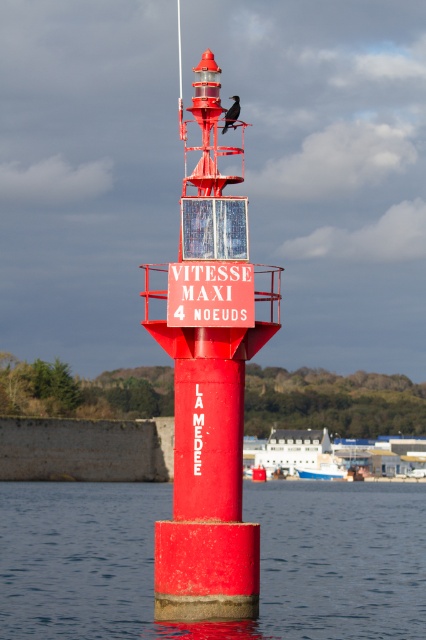
Question: Can you confirm if smooth concrete water at center is bigger than matte red buoy at center?

Choices:
 (A) no
 (B) yes

Answer: (B)

Question: Which point is farther to the camera?

Choices:
 (A) (x=112, y=612)
 (B) (x=256, y=540)

Answer: (A)

Question: From the image, what is the correct spatial relationship of smooth concrete water at center in relation to matte red buoy at center?

Choices:
 (A) left
 (B) right

Answer: (A)

Question: Among these points, which one is nearest to the camera?

Choices:
 (A) (152, 532)
 (B) (181, 340)

Answer: (B)

Question: Is smooth concrete water at center wider than matte red buoy at center?

Choices:
 (A) yes
 (B) no

Answer: (A)